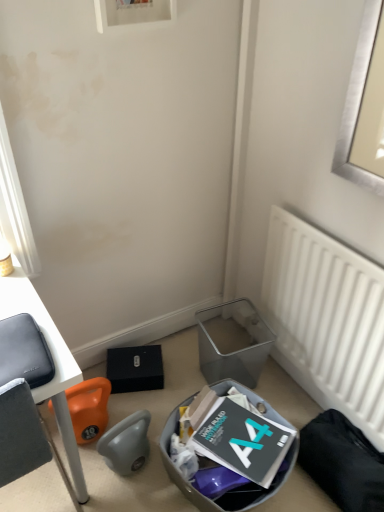
Question: From the image's perspective, would you say matte black laptop at left is shown under white matte radiator at right?

Choices:
 (A) yes
 (B) no

Answer: (A)

Question: Is matte black laptop at left positioned far away from white matte radiator at right?

Choices:
 (A) yes
 (B) no

Answer: (B)

Question: Could you tell me if matte black laptop at left is facing white matte radiator at right?

Choices:
 (A) yes
 (B) no

Answer: (B)

Question: Is matte black laptop at left positioned in front of white matte radiator at right?

Choices:
 (A) yes
 (B) no

Answer: (A)

Question: Is matte black laptop at left to the left of white matte radiator at right from the viewer's perspective?

Choices:
 (A) no
 (B) yes

Answer: (B)

Question: Does matte black laptop at left contain white matte radiator at right?

Choices:
 (A) yes
 (B) no

Answer: (B)

Question: Is metallic gray trash bin/can at lower center, the 2th trash bin/can viewed from the front, positioned before matte black laptop at left?

Choices:
 (A) no
 (B) yes

Answer: (A)

Question: From the image's perspective, is metallic gray trash bin/can at lower center, the 2th trash bin/can viewed from the front, under matte black laptop at left?

Choices:
 (A) yes
 (B) no

Answer: (B)

Question: Can you confirm if metallic gray trash bin/can at lower center, the 2th trash bin/can viewed from the front, is wider than matte black laptop at left?

Choices:
 (A) yes
 (B) no

Answer: (B)

Question: Is metallic gray trash bin/can at lower center, the 1th trash bin/can viewed from the back, in contact with matte black laptop at left?

Choices:
 (A) yes
 (B) no

Answer: (B)

Question: Does metallic gray trash bin/can at lower center, the 1th trash bin/can viewed from the back, have a lesser width compared to matte black laptop at left?

Choices:
 (A) no
 (B) yes

Answer: (B)

Question: Is metallic gray trash bin/can at lower center, the 2th trash bin/can viewed from the front, bigger than matte black laptop at left?

Choices:
 (A) no
 (B) yes

Answer: (A)

Question: Considering the relative sizes of white matte radiator at right and metallic gray trash bin at lower center, which ranks as the 1th trash bin/can in front-to-back order, in the image provided, is white matte radiator at right shorter than metallic gray trash bin at lower center, which ranks as the 1th trash bin/can in front-to-back order,?

Choices:
 (A) no
 (B) yes

Answer: (A)